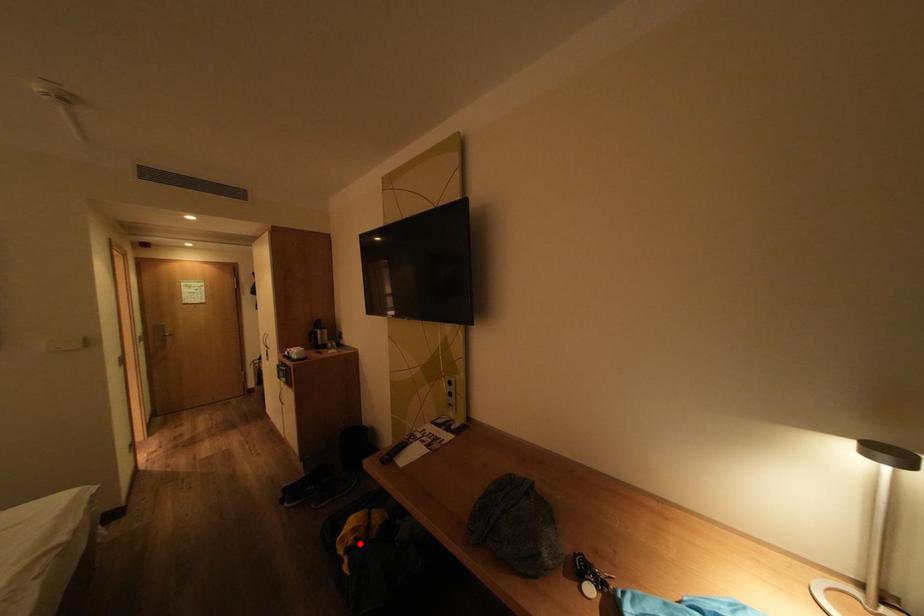
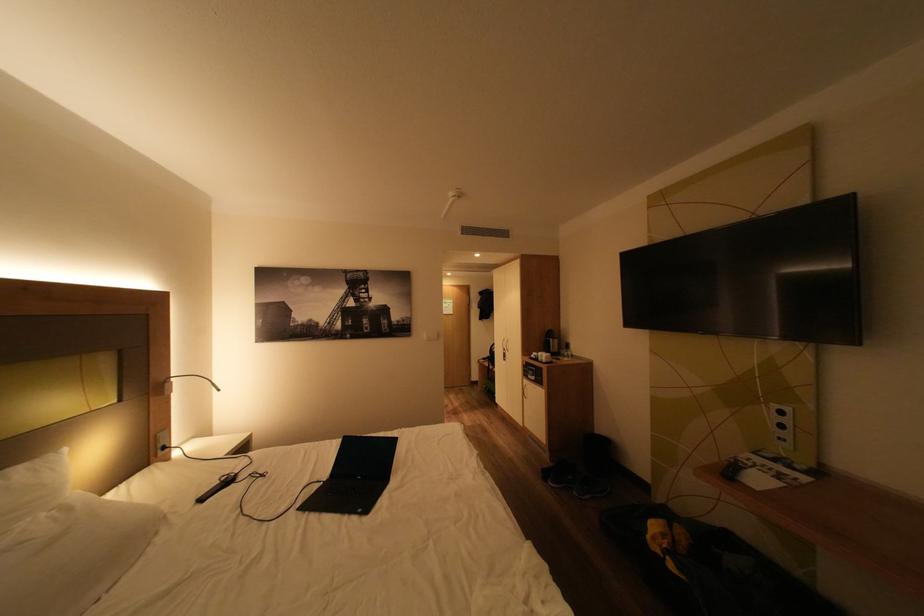
Find the pixel in the second image that matches the highlighted location in the first image.

(675, 546)